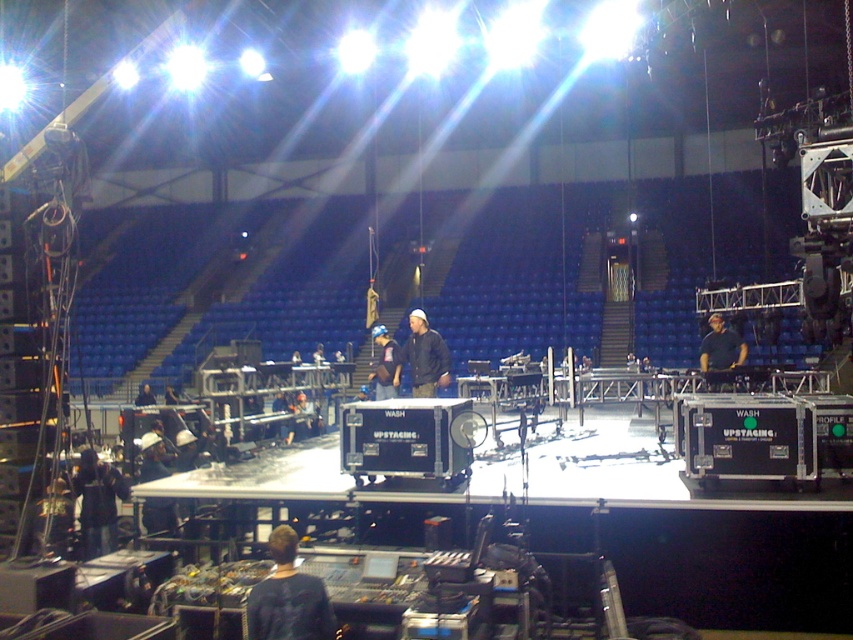
You are a stagehand needing to move a large equipment box through the space between the dark blue jacket at center and the dark blue shirt at center. Can you fit the box through this space?

The dark blue jacket at center occupies less space than dark blue shirt at center, so the space between them may be insufficient for the large equipment box to pass through.

You are a photographer positioned at the back of the arena. You need to capture a clear photo of both the dark blue jacket at center and the dark blue shirt at center. Given that your camera has a limited focus range, which object should you prioritize to ensure it appears in focus if you can only focus on one?

Since the dark blue jacket at center is narrower than the dark blue shirt at center, you should prioritize focusing on the dark blue shirt at center to ensure it appears in focus, as its larger size makes it easier to capture clearly within the limited focus range.

You are a stagehand standing at the center of the arena. You need to locate the dark blue jacket at center. According to the coordinates provided, where exactly is the dark blue jacket located?

The dark blue jacket at center is located at coordinates point (422,356).